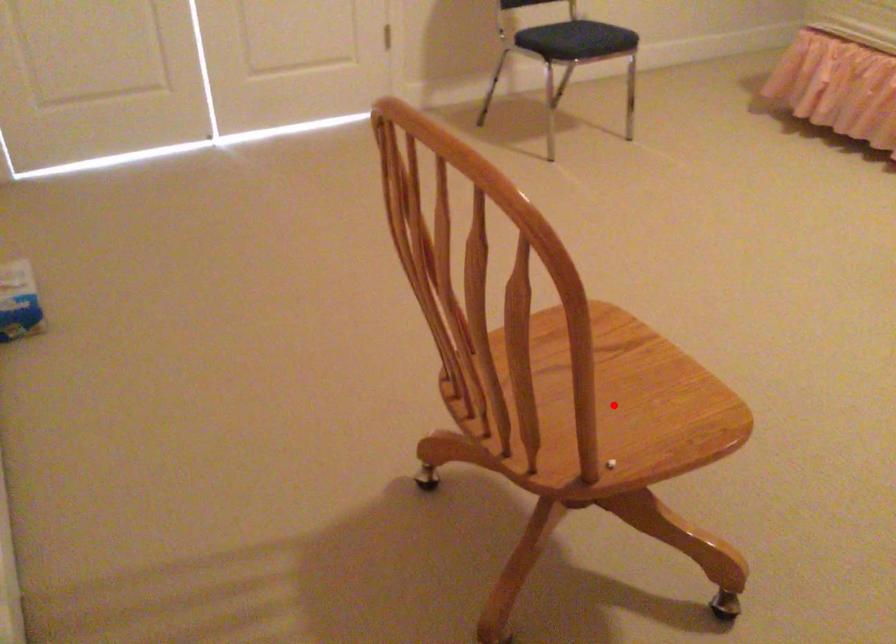
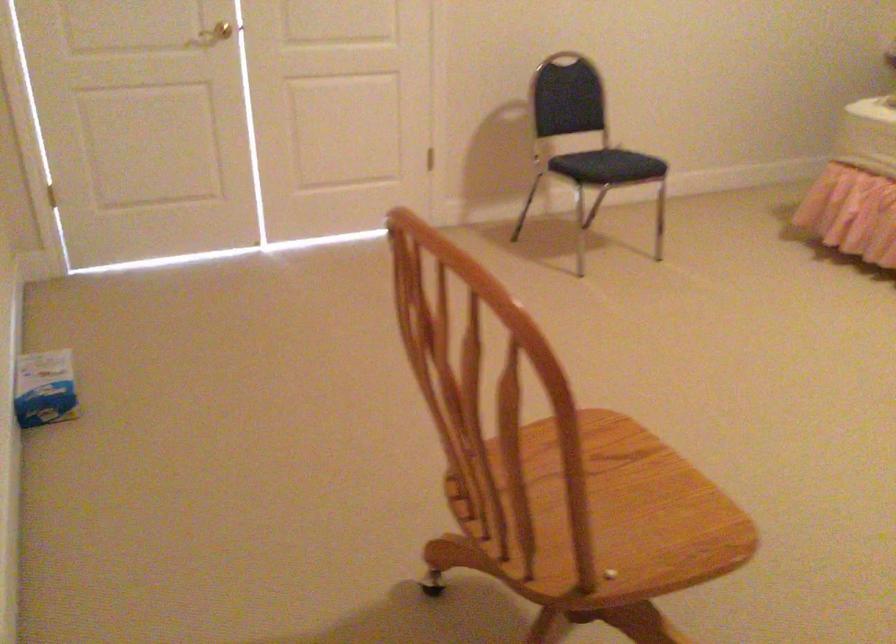
Find the pixel in the second image that matches the highlighted location in the first image.

(613, 509)